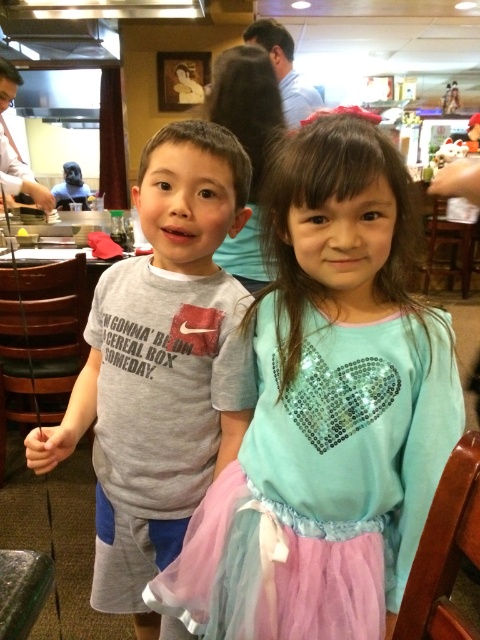
Does light blue sequined shirt at center come behind gray cotton shirt at center?

No, it is not.

Is point (333, 308) positioned behind point (95, 440)?

No, it is not.

The height and width of the screenshot is (640, 480). Identify the location of light blue sequined shirt at center. (327, 410).

I want to click on gray cotton shirt at center, so click(x=162, y=368).

In the scene shown: Can you confirm if light blue sequined shirt at center is positioned below pink tulle ballet skirt at lower center?

Incorrect, light blue sequined shirt at center is not positioned below pink tulle ballet skirt at lower center.

Is light blue sequined shirt at center taller than pink tulle ballet skirt at lower center?

Yes, light blue sequined shirt at center is taller than pink tulle ballet skirt at lower center.

Where is `light blue sequined shirt at center`? The width and height of the screenshot is (480, 640). light blue sequined shirt at center is located at coordinates click(327, 410).